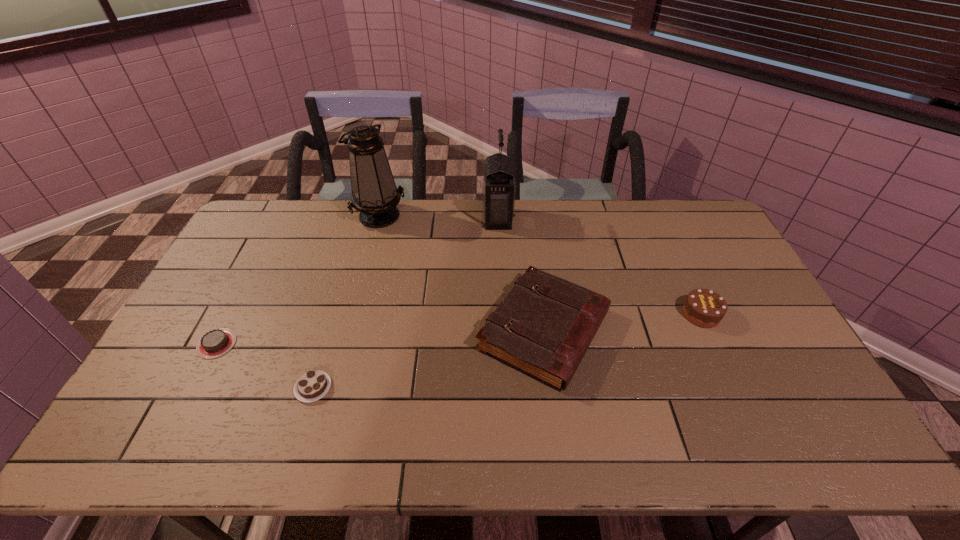
Identify the location of vacant area at the far edge of the desktop. This screenshot has height=540, width=960. (513, 227).

Find the location of a particular element. The height and width of the screenshot is (540, 960). free space at the left edge of the desktop is located at coordinates (250, 267).

Locate an element on the screen. The width and height of the screenshot is (960, 540). vacant space at the far left corner of the desktop is located at coordinates (261, 237).

At what (x,y) coordinates should I click in order to perform the action: click on vacant space at the near left corner. Please return your answer as a coordinate pair (x, y). Looking at the image, I should click on (162, 453).

The width and height of the screenshot is (960, 540). I want to click on vacant space at the near right corner of the desktop, so click(841, 447).

Image resolution: width=960 pixels, height=540 pixels. Identify the location of free point between the oil lamp and the second chocolate cake from right to left. (347, 301).

This screenshot has height=540, width=960. What are the coordinates of `free space between the leftmost chocolate cake and the oil lamp` in the screenshot? It's located at (299, 279).

Locate an element on the screen. Image resolution: width=960 pixels, height=540 pixels. vacant region between the nearest chocolate cake and the hardback book is located at coordinates (428, 359).

You are a GUI agent. You are given a task and a screenshot of the screen. Output one action in this format:
    pyautogui.click(x=<x>, y=<y>)
    Task: Click on the vacant space that is in between the nearest chocolate cake and the lantern
    This screenshot has width=960, height=540.
    Given the screenshot: What is the action you would take?
    pyautogui.click(x=406, y=303)

Image resolution: width=960 pixels, height=540 pixels. I want to click on empty location between the lantern and the leftmost object, so click(x=357, y=281).